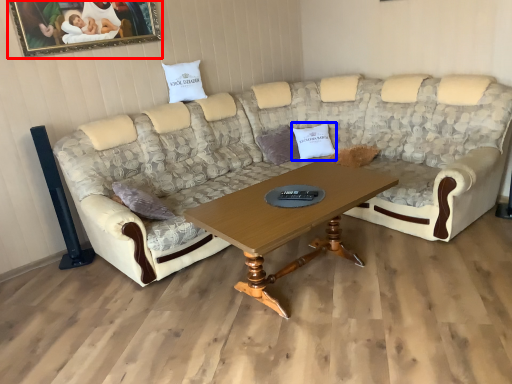
Question: Which point is further to the camera, picture frame (highlighted by a red box) or pillow (highlighted by a blue box)?

Choices:
 (A) picture frame
 (B) pillow

Answer: (B)